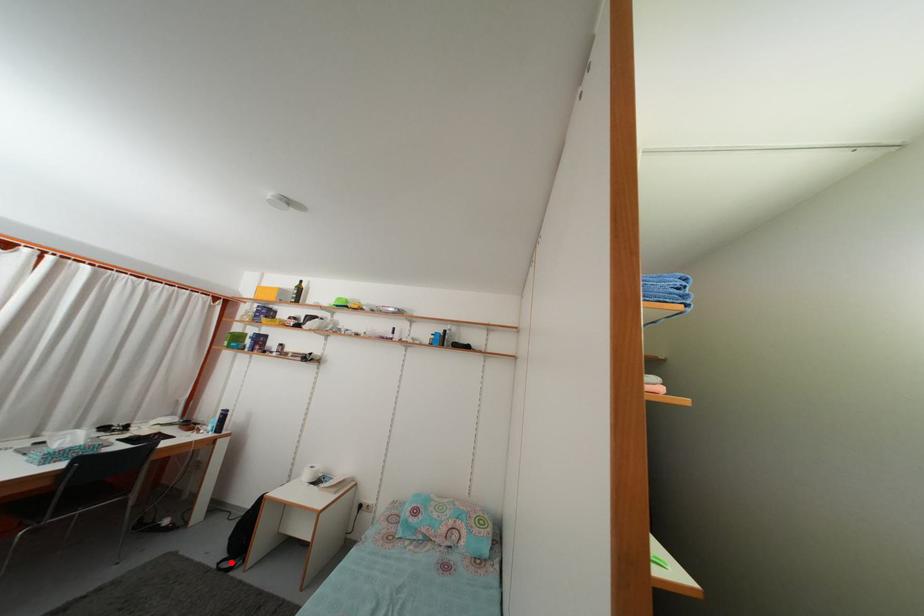
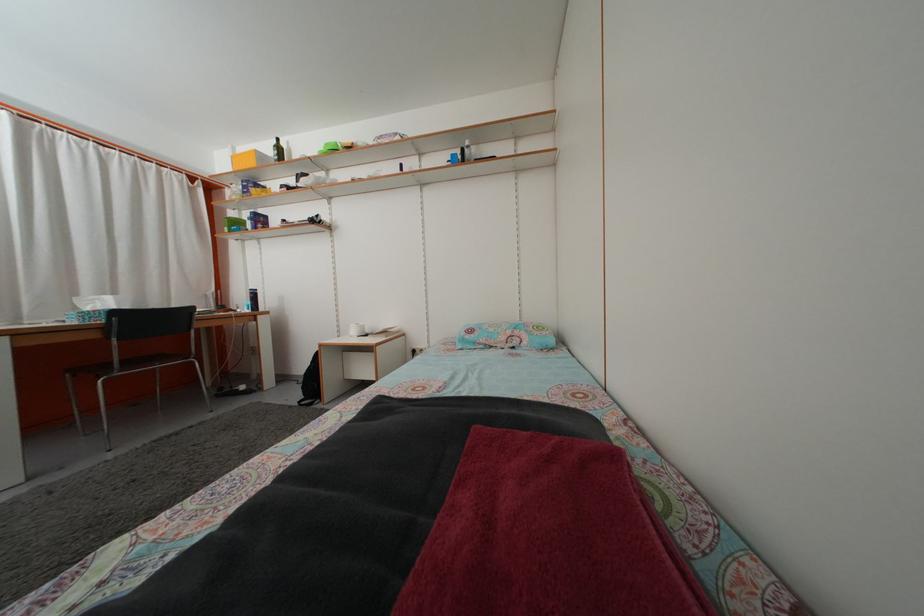
Question: I am providing you with two images of the same scene from different viewpoints. Given a red point in image1, look at the same physical point in image2. Is it:

Choices:
 (A) Closer to the viewpoint
 (B) Farther from the viewpoint

Answer: (A)